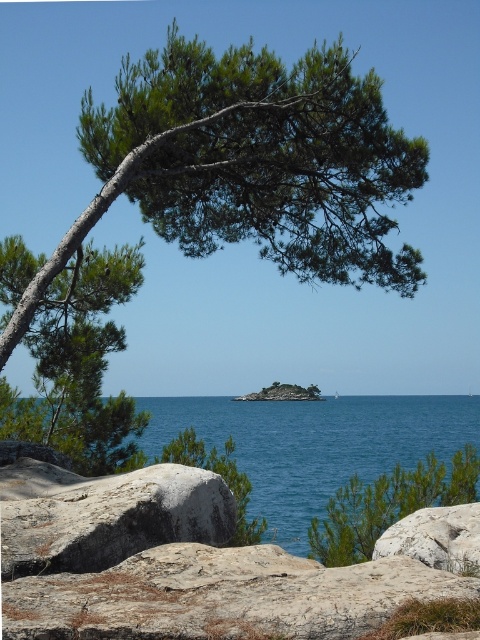
You are a drone operator trying to capture a photo of the pine tree and the rocky island. You have two markers placed at point (96, 308) and point (99, 531) in the image. Which marker should you use as a reference to ensure the pine tree is in the foreground and the rocky island is in the background?

You should use point (99, 531) as the reference because point (96, 308) is behind point (99, 531). This means placing the drone closer to point (99, 531) will keep the pine tree in the foreground while the rocky island remains in the background.